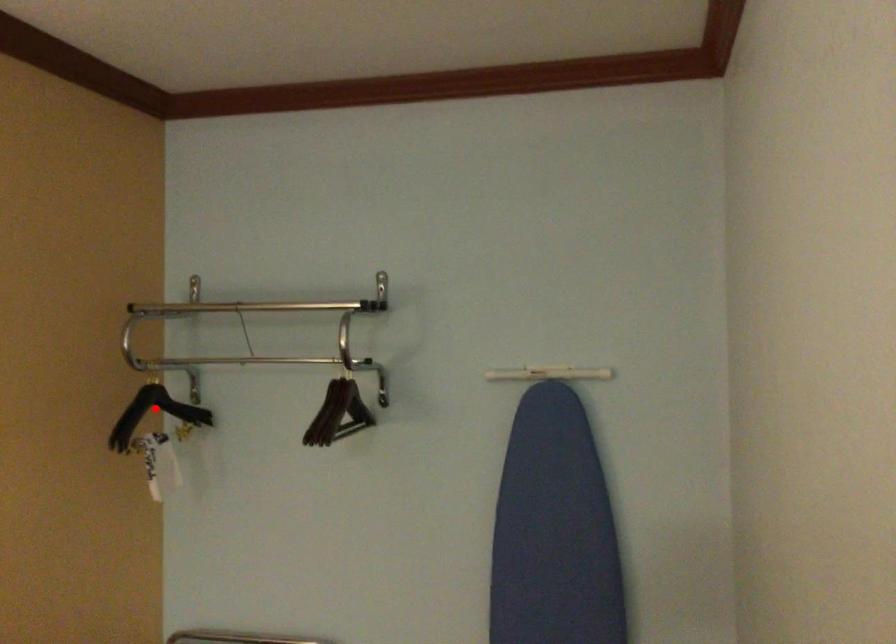
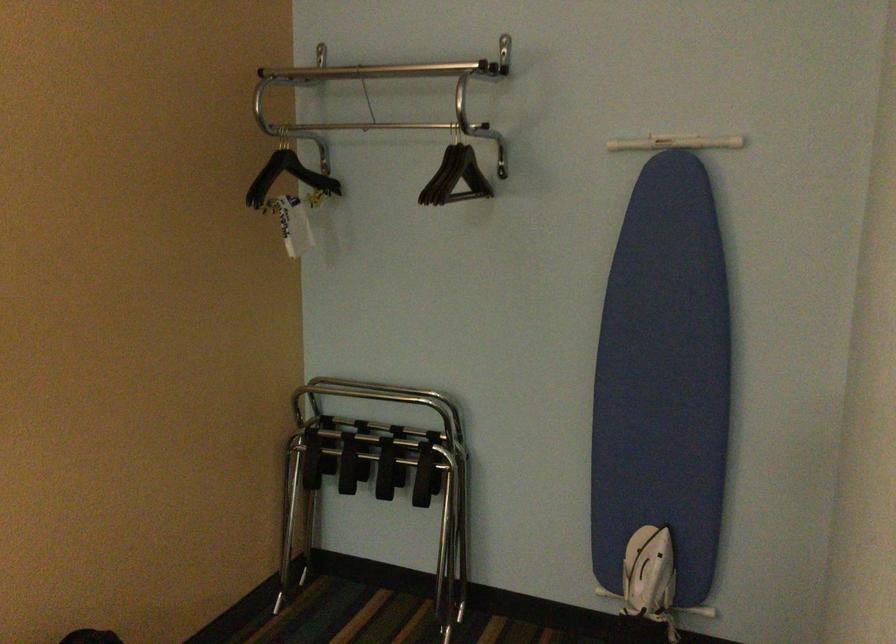
Question: I am providing you with two images of the same scene from different viewpoints. Image1 has a red point marked. In image2, the corresponding 3D location appears at what relative position? Reply with the corresponding letter.

Choices:
 (A) Closer
 (B) Farther

Answer: (B)